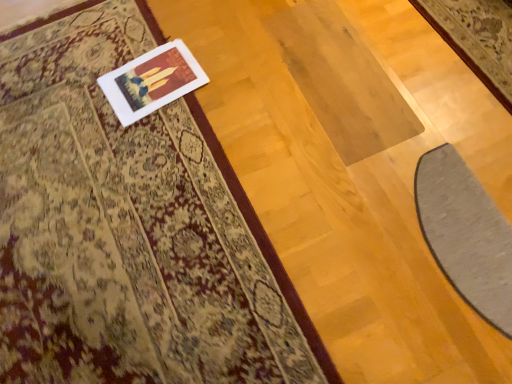
Where is `vacant point to the left of white matte picture frame at upper left`? vacant point to the left of white matte picture frame at upper left is located at coordinates (81, 97).